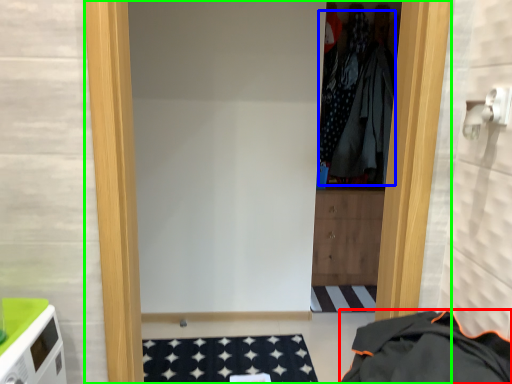
Question: Considering the real-world distances, which object is farthest from clothing (highlighted by a red box)? clothing (highlighted by a blue box) or door (highlighted by a green box)?

Choices:
 (A) clothing
 (B) door

Answer: (A)